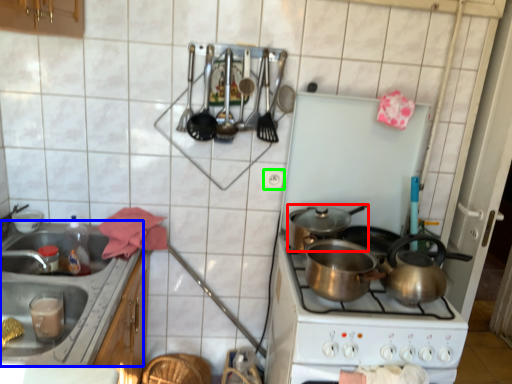
Question: Based on their relative distances, which object is nearer to kitchen appliance (highlighted by a red box)? Choose from sink (highlighted by a blue box) and electric outlet (highlighted by a green box).

Choices:
 (A) sink
 (B) electric outlet

Answer: (B)